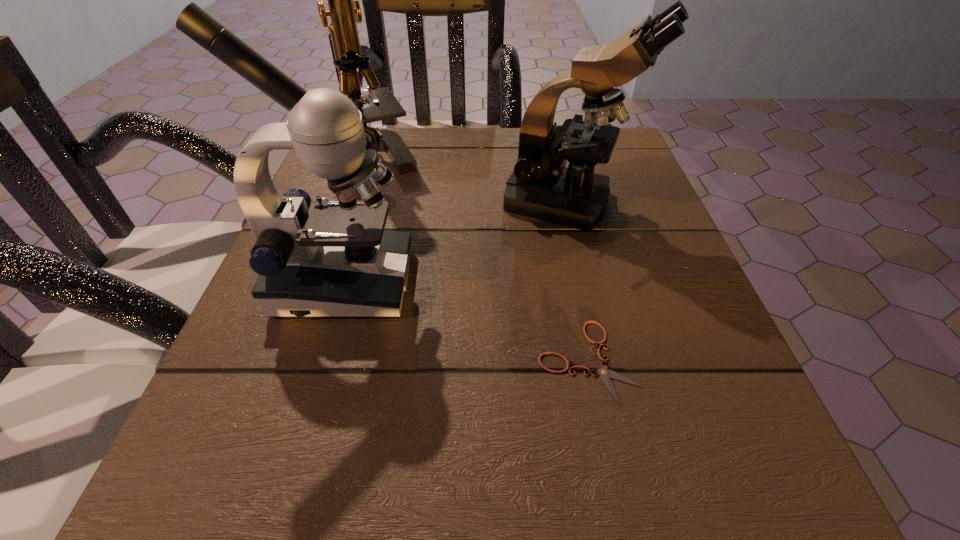
The width and height of the screenshot is (960, 540). What are the coordinates of `vacant space at the far edge of the desktop` in the screenshot? It's located at (458, 177).

Locate an element on the screen. vacant area at the left edge is located at coordinates (237, 357).

This screenshot has width=960, height=540. I want to click on vacant space at the right edge of the desktop, so click(x=622, y=232).

Locate an element on the screen. The image size is (960, 540). blank space at the near right corner of the desktop is located at coordinates (658, 494).

Locate an element on the screen. This screenshot has height=540, width=960. vacant area that lies between the rightmost microscope and the nearest microscope is located at coordinates (455, 242).

You are a GUI agent. You are given a task and a screenshot of the screen. Output one action in this format:
    pyautogui.click(x=<x>, y=<y>)
    Task: Click on the unoccupied area between the nearest microscope and the rightmost microscope
    The height and width of the screenshot is (540, 960).
    Given the screenshot: What is the action you would take?
    pyautogui.click(x=455, y=242)

Identify the location of free point between the nearest microscope and the rightmost microscope. The image size is (960, 540). (455, 242).

This screenshot has width=960, height=540. I want to click on free space between the shears and the rightmost microscope, so click(577, 281).

This screenshot has height=540, width=960. Find the location of `object that is the closest to the shortest object`. object that is the closest to the shortest object is located at coordinates (330, 258).

Point out which object is positioned as the nearest to the nearest microscope. Please provide its 2D coordinates. Your answer should be formatted as a tuple, i.e. [(x, y)], where the tuple contains the x and y coordinates of a point satisfying the conditions above.

[(541, 187)]